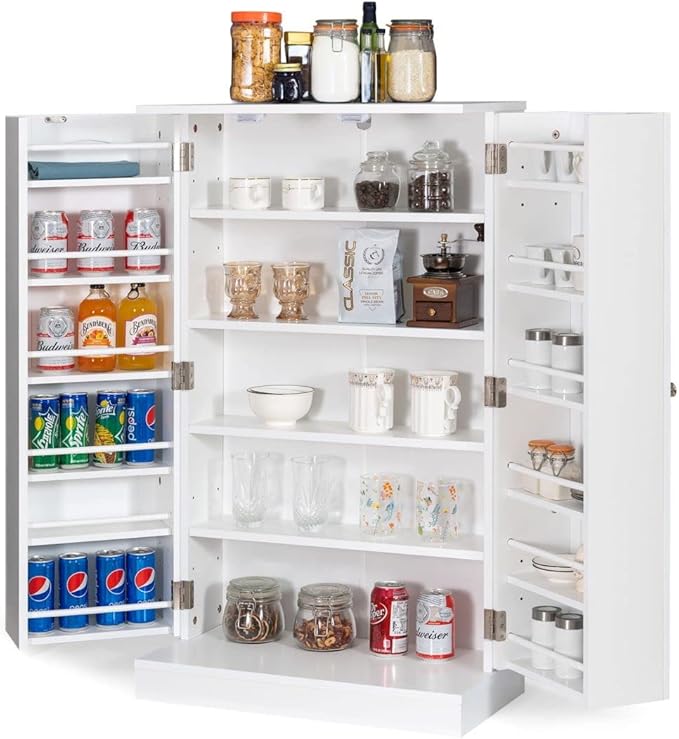
Locate an element on the screen. The image size is (679, 739). items on bottom center shelf is located at coordinates (246, 605), (335, 613), (392, 613), (449, 643).